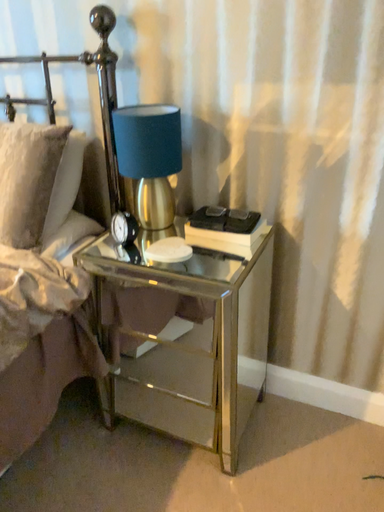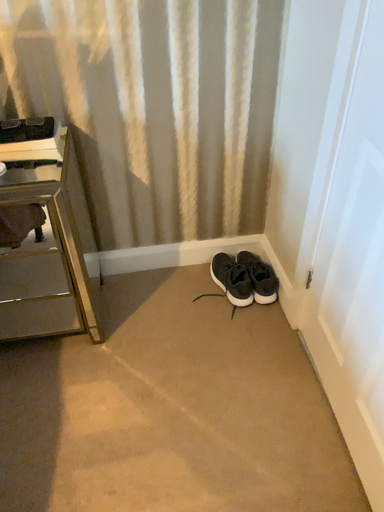
Question: Which way did the camera rotate in the video?

Choices:
 (A) rotated upward
 (B) rotated downward

Answer: (B)